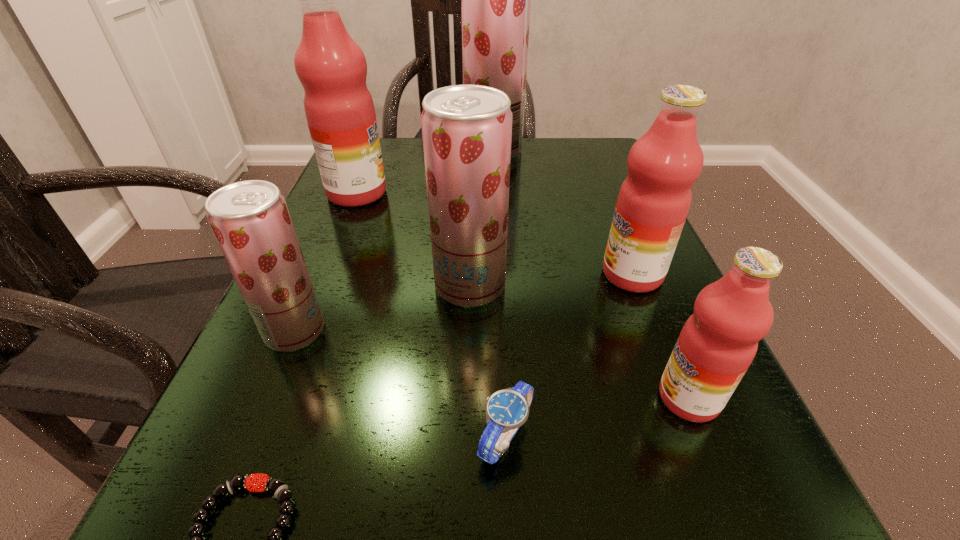
At what (x,y) coordinates should I click in order to perform the action: click on free region located 0.330m on the label of the nearest pink fruit juice. Please return your answer as a coordinate pair (x, y). This screenshot has height=540, width=960. Looking at the image, I should click on (397, 398).

Identify the location of free space located on the right of the nearest strawberry fruit juice. (462, 331).

The width and height of the screenshot is (960, 540). Find the location of `vacant space located on the back of the blue watch`. vacant space located on the back of the blue watch is located at coordinates (500, 311).

Where is `object that is positioned at the far left corner`? object that is positioned at the far left corner is located at coordinates (332, 68).

Locate an element on the screen. The width and height of the screenshot is (960, 540). vacant space at the far edge of the desktop is located at coordinates (529, 153).

Identify the location of free space at the near edge of the desktop. The width and height of the screenshot is (960, 540). (557, 507).

The width and height of the screenshot is (960, 540). What are the coordinates of `vacant space at the left edge` in the screenshot? It's located at (316, 239).

What are the coordinates of `free space at the right edge of the desktop` in the screenshot? It's located at (660, 291).

The image size is (960, 540). What are the coordinates of `vacant space at the far right corner of the desktop` in the screenshot? It's located at (606, 170).

At what (x,y) coordinates should I click in order to perform the action: click on vacant region at the near right corner of the desktop. Please return your answer as a coordinate pair (x, y). Looking at the image, I should click on (776, 497).